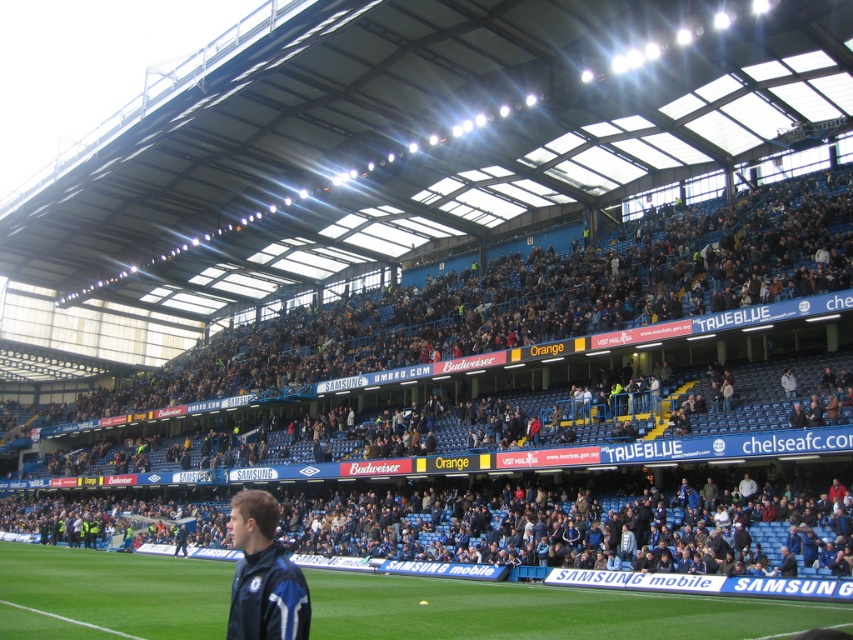
Does green grass at center have a greater height compared to blue fabric jacket at lower left?

No.

Consider the image. Is green grass at center positioned at the back of blue fabric jacket at lower left?

Yes, it is behind blue fabric jacket at lower left.

Find the location of a particular element. This screenshot has height=640, width=853. green grass at center is located at coordinates (541, 611).

This screenshot has width=853, height=640. I want to click on green grass at center, so click(541, 611).

This screenshot has width=853, height=640. What are the coordinates of `blue fabric seats at upper center` in the screenshot? It's located at (604, 371).

Is blue fabric seats at upper center behind green grass at center?

Yes, it is behind green grass at center.

Who is more distant from viewer, (728, 252) or (79, 579)?

Point (728, 252)

The image size is (853, 640). Find the location of `blue fabric seats at upper center`. blue fabric seats at upper center is located at coordinates (604, 371).

Is blue fabric seats at upper center taller than blue fabric jacket at lower left?

Correct, blue fabric seats at upper center is much taller as blue fabric jacket at lower left.

Between point (0, 502) and point (257, 545), which one is positioned behind?

Point (0, 502)

Is point (422, 449) farther from viewer compared to point (259, 524)?

That is True.

In order to click on blue fabric seats at upper center in this screenshot , I will do `click(604, 371)`.